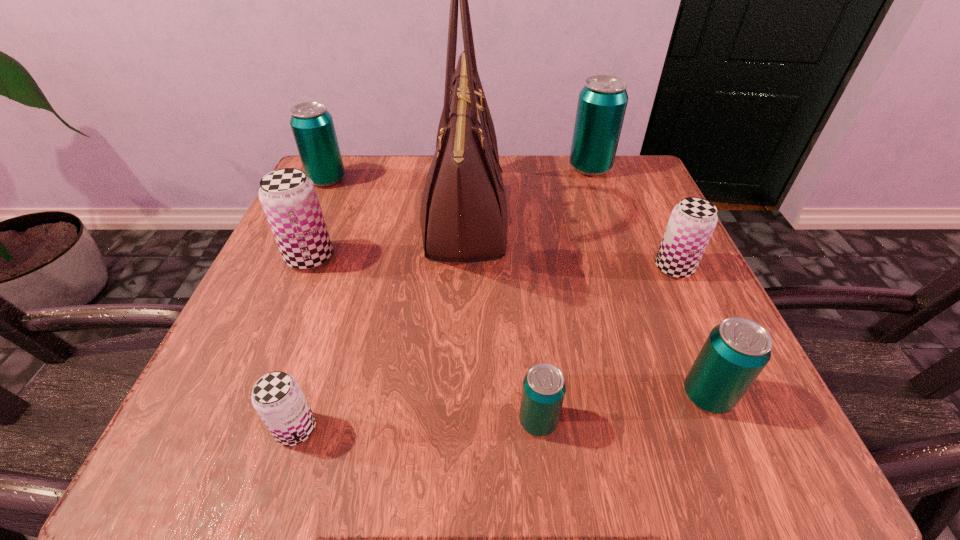
You are a GUI agent. You are given a task and a screenshot of the screen. Output one action in this format:
    pyautogui.click(x=<x>, y=<y>)
    Task: Click on the handbag
    
    Given the screenshot: What is the action you would take?
    pyautogui.click(x=463, y=216)

Where is `the second tallest object`? the second tallest object is located at coordinates (602, 102).

What are the coordinates of `the biggest teal beer can` in the screenshot? It's located at (602, 102).

Identify the location of the third smallest teal beer can. The height and width of the screenshot is (540, 960). (312, 125).

The width and height of the screenshot is (960, 540). I want to click on the biggest purple beer can, so click(x=289, y=199).

Locate an element on the screen. This screenshot has width=960, height=540. the rightmost purple beer can is located at coordinates (691, 224).

Find the location of `the second smallest teal beer can`. the second smallest teal beer can is located at coordinates (736, 351).

Where is `the third beer can from left to right`? The height and width of the screenshot is (540, 960). the third beer can from left to right is located at coordinates (277, 397).

Locate an element on the screen. This screenshot has width=960, height=540. the third object from left to right is located at coordinates point(277,397).

At what (x,y) coordinates should I click in order to perform the action: click on the smallest teal beer can. Please return your answer as a coordinate pair (x, y). The height and width of the screenshot is (540, 960). Looking at the image, I should click on (543, 391).